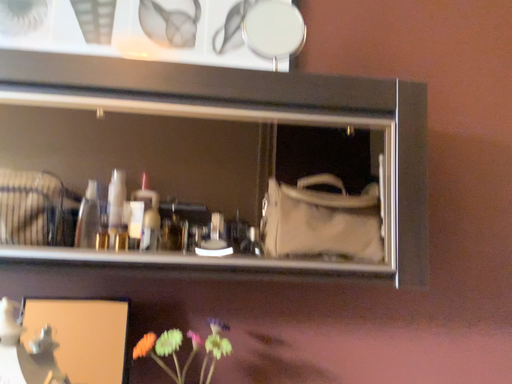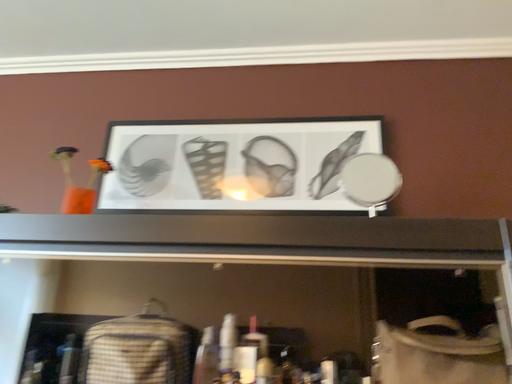
Question: Which way did the camera rotate in the video?

Choices:
 (A) rotated left
 (B) rotated right

Answer: (A)